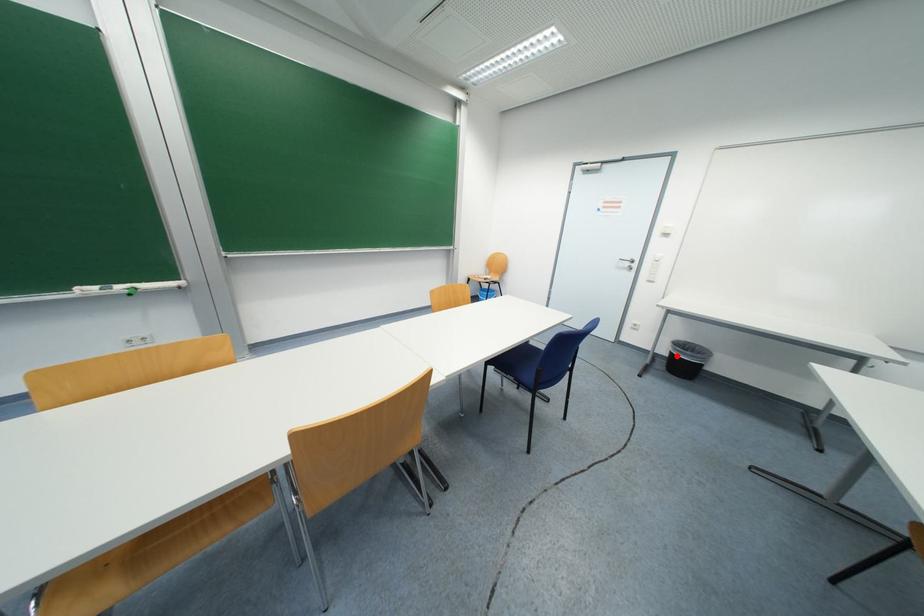
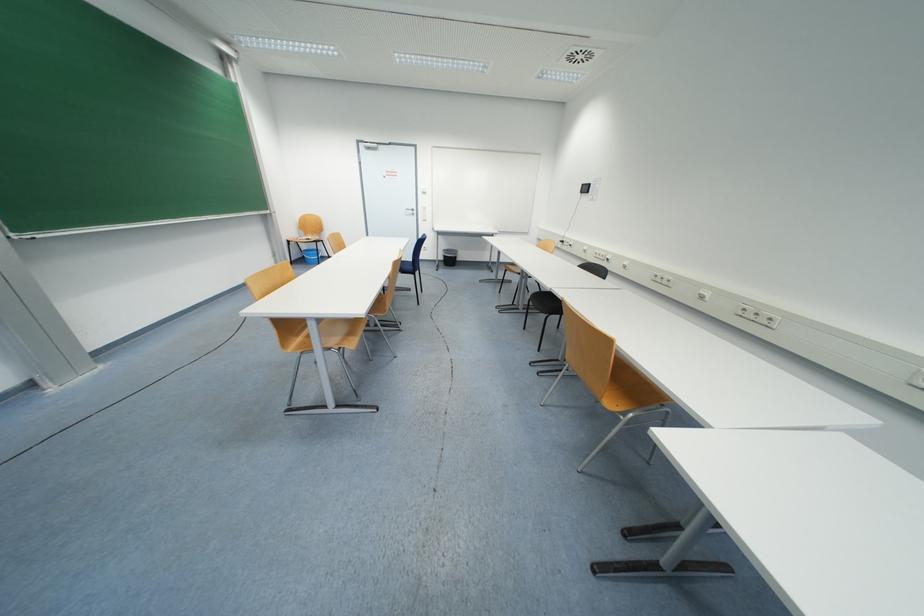
The point at the highlighted location is marked in the first image. Where is the corresponding point in the second image?

(448, 257)